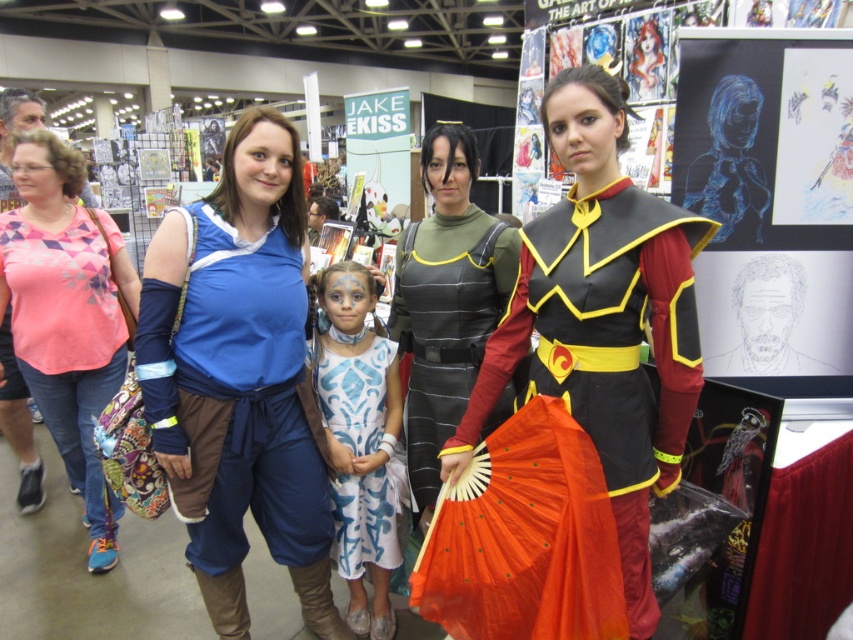
Question: Which of these objects is positioned farthest from the blue chalk drawing of a woman at center?

Choices:
 (A) matte blue shirt at center
 (B) leather-like armor at center

Answer: (A)

Question: Observing the image, what is the correct spatial positioning of shiny black armor at center in reference to leather-like armor at center?

Choices:
 (A) right
 (B) left

Answer: (A)

Question: Which point is closer to the camera?

Choices:
 (A) leather-like armor at center
 (B) blue chalk drawing of a woman at center

Answer: (B)

Question: Is matte blue shirt at center thinner than pink printed shirt at left?

Choices:
 (A) yes
 (B) no

Answer: (A)

Question: Does leather-like armor at center appear on the left side of white painted fabric dress at center?

Choices:
 (A) yes
 (B) no

Answer: (B)

Question: Which of the following is the closest to the observer?

Choices:
 (A) (415, 308)
 (B) (164, 416)
 (C) (76, 406)

Answer: (B)